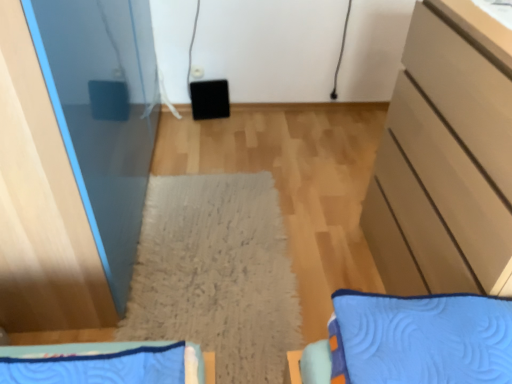
Where is `beige textured mat at center`? The width and height of the screenshot is (512, 384). beige textured mat at center is located at coordinates click(216, 274).

Identify the location of matte beige cabinet at right. (443, 169).

Find the location of `blue quilted bedspread at lower left`. blue quilted bedspread at lower left is located at coordinates (74, 349).

Could you tell me if blue quilted bedspread at lower left is facing matte beige cabinet at right?

No.

In the scene shown: From the image's perspective, which one is positioned higher, blue quilted bedspread at lower left or matte beige cabinet at right?

matte beige cabinet at right is shown above in the image.

Looking at the image, does blue quilted bedspread at lower left seem bigger or smaller compared to matte beige cabinet at right?

blue quilted bedspread at lower left is smaller than matte beige cabinet at right.

Is blue quilted bedspread at lower left inside the boundaries of matte beige cabinet at right, or outside?

→ blue quilted bedspread at lower left is spatially situated outside matte beige cabinet at right.

Can you confirm if matte beige cabinet at right is smaller than blue quilted bedspread at lower left?

No, matte beige cabinet at right is not smaller than blue quilted bedspread at lower left.

Who is more distant, matte beige cabinet at right or blue quilted bedspread at lower left?

matte beige cabinet at right is behind.

Can blue quilted bedspread at lower left be found inside matte beige cabinet at right?

That's incorrect, blue quilted bedspread at lower left is not inside matte beige cabinet at right.

Measure the distance between matte beige cabinet at right and blue quilted bedspread at lower left.

matte beige cabinet at right and blue quilted bedspread at lower left are 32.91 inches apart from each other.

From the image's perspective, which is below, matte beige cabinet at right or beige textured mat at center?

beige textured mat at center is shown below in the image.

Is matte beige cabinet at right to the left or to the right of beige textured mat at center in the image?

Based on their positions, matte beige cabinet at right is located to the right of beige textured mat at center.

Consider the image. Which is less distant, (459, 280) or (166, 337)?

The point (459, 280) is more forward.

From a real-world perspective, is matte beige cabinet at right on top of beige textured mat at center?

Yes, from a real-world perspective, matte beige cabinet at right is above beige textured mat at center.

Is blue quilted bedspread at lower left positioned far away from beige textured mat at center?

That's not correct — blue quilted bedspread at lower left is a little close to beige textured mat at center.

Which is behind, blue quilted bedspread at lower left or beige textured mat at center?

beige textured mat at center is further from the camera.

Which of these two, blue quilted bedspread at lower left or beige textured mat at center, stands shorter?

beige textured mat at center is shorter.

At what (x,y) coordinates should I click in order to perform the action: click on furniture below the beige textured mat at center (from the image's perspective). Please return your answer as a coordinate pair (x, y). Looking at the image, I should click on (74, 349).

From a real-world perspective, is beige textured mat at center on top of matte beige cabinet at right?

No, from a real-world perspective, beige textured mat at center is not on top of matte beige cabinet at right.

Between beige textured mat at center and matte beige cabinet at right, which one has smaller size?

Smaller between the two is beige textured mat at center.

What's the angular difference between beige textured mat at center and matte beige cabinet at right's facing directions?

89.6 degrees separate the facing orientations of beige textured mat at center and matte beige cabinet at right.

How far apart are beige textured mat at center and blue quilted bedspread at lower left?

beige textured mat at center is 20.15 inches from blue quilted bedspread at lower left.

Considering the positions of point (181, 262) and point (20, 349), is point (181, 262) closer or farther from the camera than point (20, 349)?

Point (181, 262) is farther from the camera than point (20, 349).

Can you confirm if beige textured mat at center is positioned to the right of blue quilted bedspread at lower left?

Indeed, beige textured mat at center is positioned on the right side of blue quilted bedspread at lower left.

Is beige textured mat at center not inside blue quilted bedspread at lower left?

Yes, beige textured mat at center is located beyond the bounds of blue quilted bedspread at lower left.

I want to click on cabinetry on the right side of blue quilted bedspread at lower left, so click(x=443, y=169).

The height and width of the screenshot is (384, 512). In order to click on cabinetry behind the blue quilted bedspread at lower left in this screenshot , I will do point(443,169).

When comparing their distances from beige textured mat at center, does matte beige cabinet at right or blue quilted bedspread at lower left seem further?

matte beige cabinet at right.

Which object lies further to the anchor point blue quilted bedspread at lower left, matte beige cabinet at right or beige textured mat at center?

matte beige cabinet at right is positioned further to the anchor blue quilted bedspread at lower left.

Considering their positions, is blue quilted bedspread at lower left positioned closer to beige textured mat at center than matte beige cabinet at right?

Among the two, blue quilted bedspread at lower left is located nearer to beige textured mat at center.

Considering their positions, is beige textured mat at center positioned closer to blue quilted bedspread at lower left than matte beige cabinet at right?

beige textured mat at center.

Considering their positions, is beige textured mat at center positioned closer to matte beige cabinet at right than blue quilted bedspread at lower left?

beige textured mat at center is closer to matte beige cabinet at right.

Looking at the image, which one is located further to matte beige cabinet at right, blue quilted bedspread at lower left or beige textured mat at center?

blue quilted bedspread at lower left is positioned further to the anchor matte beige cabinet at right.

The image size is (512, 384). Identify the location of mat located between blue quilted bedspread at lower left and matte beige cabinet at right in the left-right direction. (216, 274).